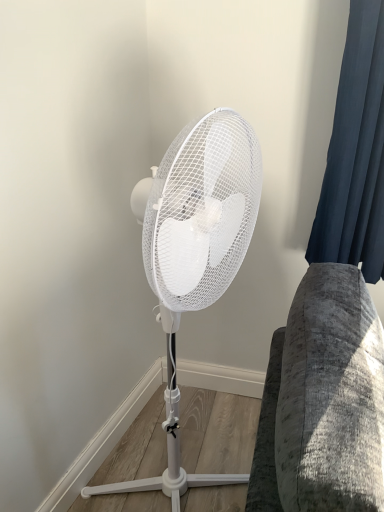
Question: In terms of width, does dark blue fabric at right look wider or thinner when compared to white matte mechanical fan at center?

Choices:
 (A) thin
 (B) wide

Answer: (A)

Question: From the image's perspective, is dark blue fabric at right located above or below white matte mechanical fan at center?

Choices:
 (A) below
 (B) above

Answer: (B)

Question: Looking at the image, does dark blue fabric at right seem bigger or smaller compared to white matte mechanical fan at center?

Choices:
 (A) small
 (B) big

Answer: (A)

Question: Does point (183, 473) appear closer or farther from the camera than point (349, 262)?

Choices:
 (A) farther
 (B) closer

Answer: (A)

Question: Would you say white matte mechanical fan at center is to the left or to the right of dark blue fabric at right in the picture?

Choices:
 (A) right
 (B) left

Answer: (B)

Question: Relative to dark blue fabric at right, is white matte mechanical fan at center in front or behind?

Choices:
 (A) behind
 (B) front

Answer: (B)

Question: From a real-world perspective, is white matte mechanical fan at center above or below dark blue fabric at right?

Choices:
 (A) above
 (B) below

Answer: (B)